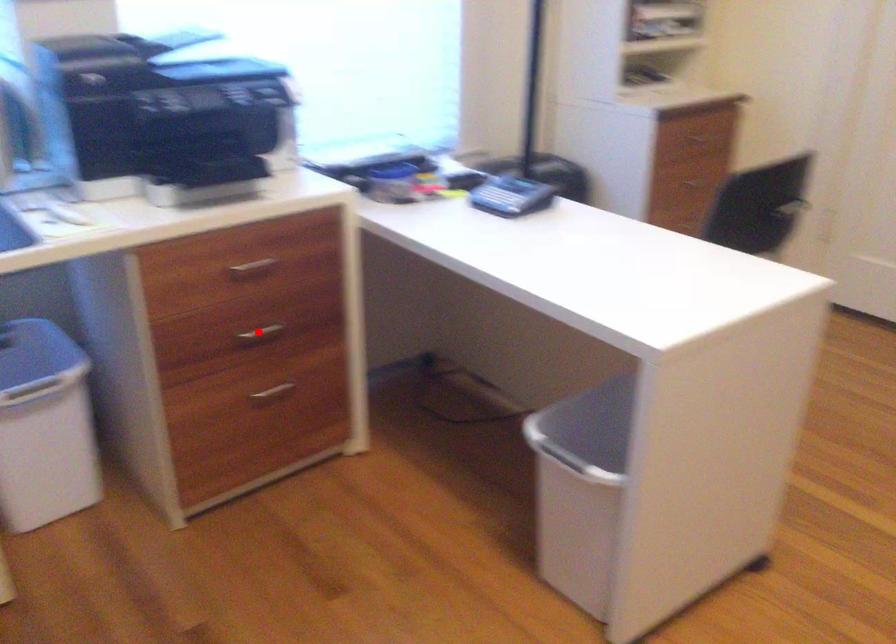
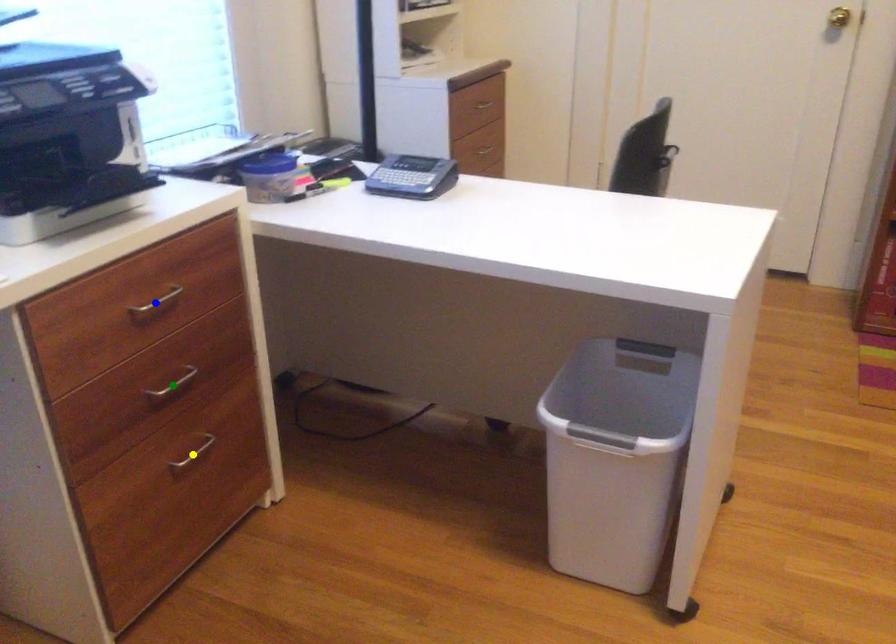
Question: I am providing you with two images of the same scene from different viewpoints. A red point is marked on the first image. You are given multiple points on the second image. Which mark in image 2 goes with the point in image 1?

Choices:
 (A) blue point
 (B) yellow point
 (C) green point

Answer: (C)